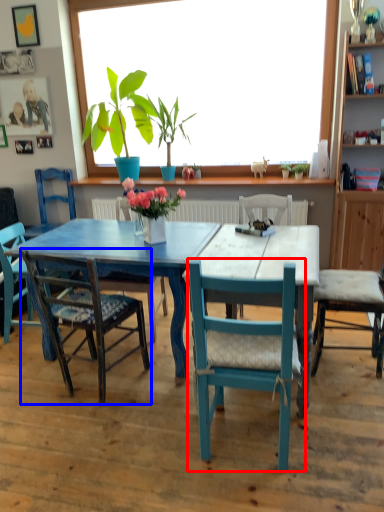
Question: Among these objects, which one is farthest to the camera, chair (highlighted by a red box) or chair (highlighted by a blue box)?

Choices:
 (A) chair
 (B) chair

Answer: (B)